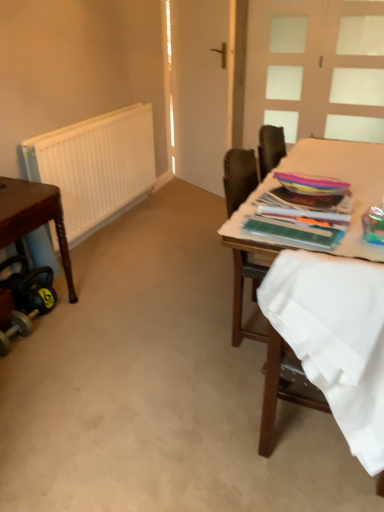
Question: Is white frosted glass door at upper right further to the viewer compared to wooden table at right?

Choices:
 (A) yes
 (B) no

Answer: (A)

Question: Does white frosted glass door at upper right have a lesser height compared to wooden table at right?

Choices:
 (A) no
 (B) yes

Answer: (A)

Question: Is white frosted glass door at upper right in contact with wooden table at right?

Choices:
 (A) no
 (B) yes

Answer: (A)

Question: Is white frosted glass door at upper right to the left of wooden table at right from the viewer's perspective?

Choices:
 (A) yes
 (B) no

Answer: (B)

Question: Considering the relative positions of white frosted glass door at upper right and wooden table at right in the image provided, is white frosted glass door at upper right to the right of wooden table at right from the viewer's perspective?

Choices:
 (A) no
 (B) yes

Answer: (B)

Question: Would you say white matte barn door at center is to the left or to the right of white frosted glass door at upper right in the picture?

Choices:
 (A) left
 (B) right

Answer: (A)

Question: In terms of height, does white matte barn door at center look taller or shorter compared to white frosted glass door at upper right?

Choices:
 (A) short
 (B) tall

Answer: (B)

Question: Relative to white frosted glass door at upper right, is white matte barn door at center in front or behind?

Choices:
 (A) behind
 (B) front

Answer: (B)

Question: Choose the correct answer: Is white matte barn door at center inside white frosted glass door at upper right or outside it?

Choices:
 (A) outside
 (B) inside

Answer: (A)

Question: Considering the positions of white fabric at right and brown wooden table at left in the image, is white fabric at right wider or thinner than brown wooden table at left?

Choices:
 (A) wide
 (B) thin

Answer: (B)

Question: Visually, is white fabric at right positioned to the left or to the right of brown wooden table at left?

Choices:
 (A) right
 (B) left

Answer: (A)

Question: From a real-world perspective, is white fabric at right physically located above or below brown wooden table at left?

Choices:
 (A) below
 (B) above

Answer: (B)

Question: Considering their positions, is white fabric at right located in front of or behind brown wooden table at left?

Choices:
 (A) behind
 (B) front

Answer: (B)

Question: From the image's perspective, is white matte radiator at left positioned above or below brown wooden table at left?

Choices:
 (A) above
 (B) below

Answer: (A)

Question: In terms of width, does white matte radiator at left look wider or thinner when compared to brown wooden table at left?

Choices:
 (A) thin
 (B) wide

Answer: (A)